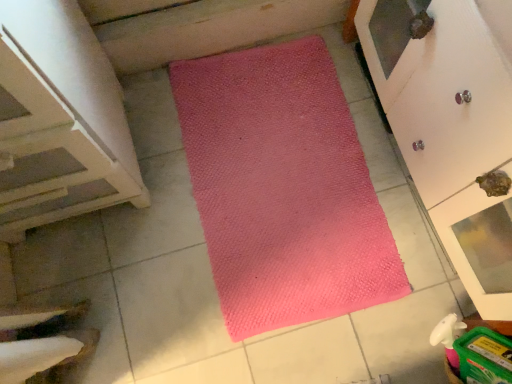
Where is `free point below pink textured mat at center (from a real-world perspective)`? The height and width of the screenshot is (384, 512). free point below pink textured mat at center (from a real-world perspective) is located at coordinates (273, 170).